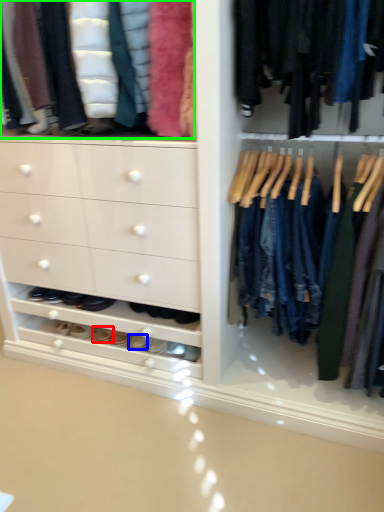
Question: Considering the real-world distances, which object is farthest from footwear (highlighted by a red box)? footwear (highlighted by a blue box) or clothing (highlighted by a green box)?

Choices:
 (A) footwear
 (B) clothing

Answer: (B)